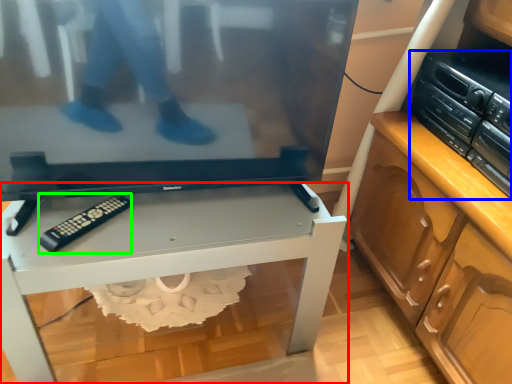
Question: Which object is positioned closest to desk (highlighted by a red box)? Select from stereo (highlighted by a blue box) and control (highlighted by a green box).

Choices:
 (A) stereo
 (B) control

Answer: (B)